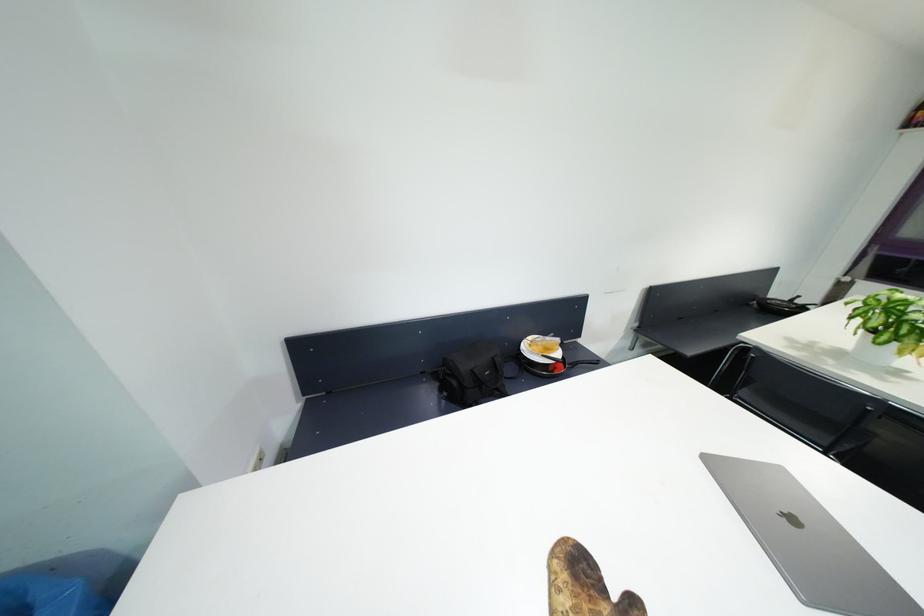
The height and width of the screenshot is (616, 924). In order to click on black chair sitting surface in this screenshot , I will do `click(386, 403)`.